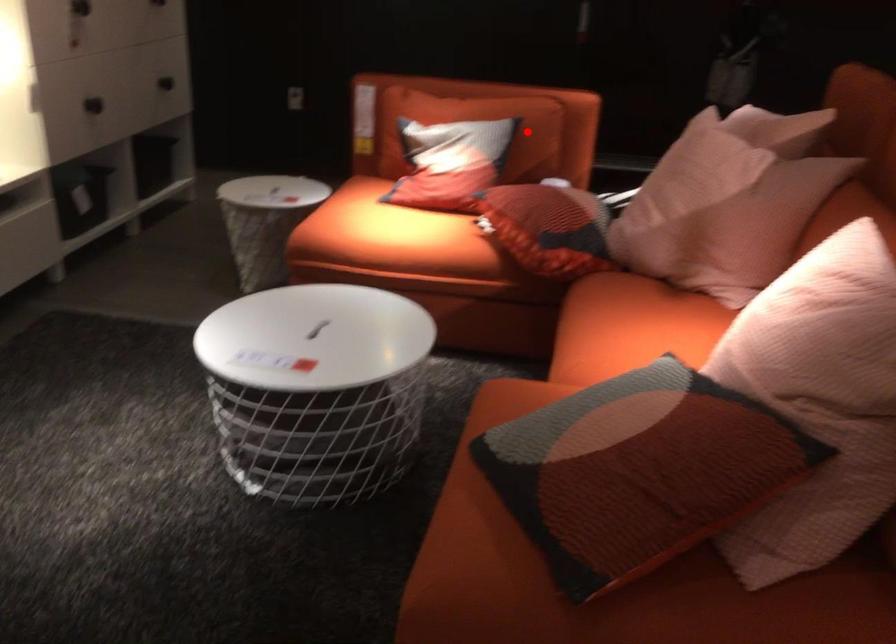
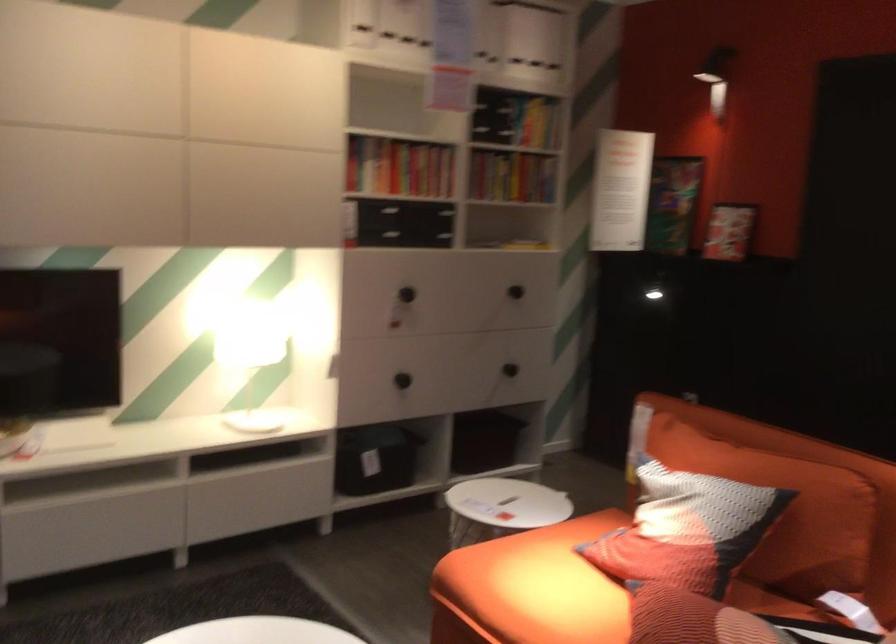
Question: I am providing you with two images of the same scene from different viewpoints. In image1, a red point is highlighted. Considering the same 3D point in image2, which of the following is correct?

Choices:
 (A) It is closer
 (B) It is farther

Answer: (A)